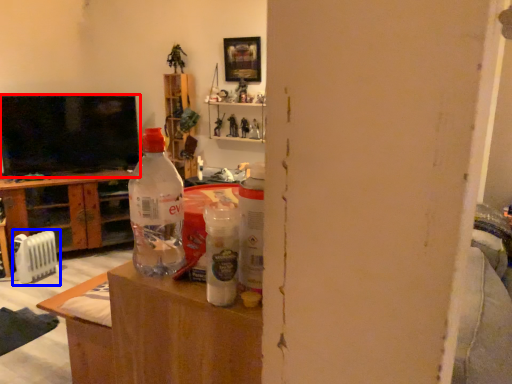
Question: Among these objects, which one is farthest to the camera, television (highlighted by a red box) or appliance (highlighted by a blue box)?

Choices:
 (A) television
 (B) appliance

Answer: (A)